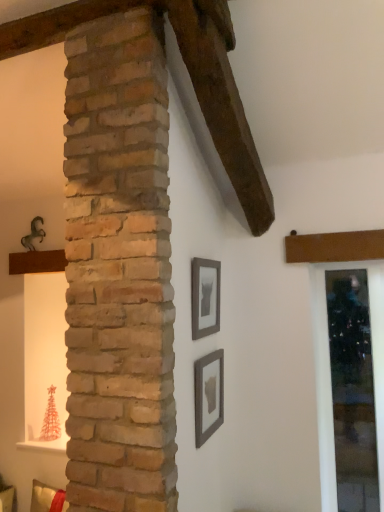
Question: Is clear glass door at right further to camera compared to matte gray picture frame at center, placed as the 1th picture frame when sorted from top to bottom?

Choices:
 (A) no
 (B) yes

Answer: (B)

Question: Considering the relative positions of clear glass door at right and matte gray picture frame at center, placed as the 1th picture frame when sorted from top to bottom, in the image provided, is clear glass door at right to the right of matte gray picture frame at center, placed as the 1th picture frame when sorted from top to bottom, from the viewer's perspective?

Choices:
 (A) no
 (B) yes

Answer: (B)

Question: Is clear glass door at right facing away from matte gray picture frame at center, placed as the 1th picture frame when sorted from top to bottom?

Choices:
 (A) yes
 (B) no

Answer: (B)

Question: Is clear glass door at right positioned far away from matte gray picture frame at center, placed as the 1th picture frame when sorted from top to bottom?

Choices:
 (A) no
 (B) yes

Answer: (A)

Question: Can you confirm if clear glass door at right is taller than matte gray picture frame at center, placed as the 1th picture frame when sorted from top to bottom?

Choices:
 (A) no
 (B) yes

Answer: (B)

Question: In terms of height, does matte gray picture frame at center, the second picture frame from the bottom, look taller or shorter compared to matte gray picture frame at lower center, the 1th picture frame in the bottom-to-top sequence?

Choices:
 (A) tall
 (B) short

Answer: (A)

Question: Relative to matte gray picture frame at lower center, the second picture frame viewed from the top, is matte gray picture frame at center, the second picture frame from the bottom, in front or behind?

Choices:
 (A) front
 (B) behind

Answer: (B)

Question: Would you say matte gray picture frame at center, the second picture frame from the bottom, is inside or outside matte gray picture frame at lower center, the 1th picture frame in the bottom-to-top sequence?

Choices:
 (A) outside
 (B) inside

Answer: (A)

Question: Looking at their shapes, would you say matte gray picture frame at center, placed as the 1th picture frame when sorted from top to bottom, is wider or thinner than matte gray picture frame at lower center, the 1th picture frame in the bottom-to-top sequence?

Choices:
 (A) thin
 (B) wide

Answer: (A)

Question: Considering the positions of point (377, 419) and point (206, 264), is point (377, 419) closer or farther from the camera than point (206, 264)?

Choices:
 (A) closer
 (B) farther

Answer: (B)

Question: In terms of height, does clear glass door at right look taller or shorter compared to matte gray picture frame at center, the second picture frame from the bottom?

Choices:
 (A) short
 (B) tall

Answer: (B)

Question: In the image, is clear glass door at right positioned in front of or behind matte gray picture frame at center, placed as the 1th picture frame when sorted from top to bottom?

Choices:
 (A) front
 (B) behind

Answer: (B)

Question: Is clear glass door at right situated inside matte gray picture frame at center, placed as the 1th picture frame when sorted from top to bottom, or outside?

Choices:
 (A) outside
 (B) inside

Answer: (A)

Question: Does point (377, 377) appear closer or farther from the camera than point (195, 394)?

Choices:
 (A) farther
 (B) closer

Answer: (A)

Question: In terms of height, does clear glass door at right look taller or shorter compared to matte gray picture frame at lower center, the second picture frame viewed from the top?

Choices:
 (A) short
 (B) tall

Answer: (B)